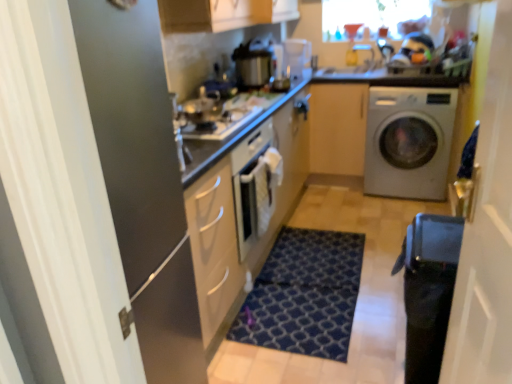
Where is `dark blue textured rug at center`? This screenshot has width=512, height=384. dark blue textured rug at center is located at coordinates (304, 294).

What do you see at coordinates (399, 76) in the screenshot?
I see `white glossy countertop at upper center` at bounding box center [399, 76].

The image size is (512, 384). Describe the element at coordinates (409, 142) in the screenshot. I see `satin silver washing machine at right` at that location.

Identify the location of metallic silver pot at center. This screenshot has height=384, width=512. (204, 108).

Can you confirm if black glossy water heater at lower right is smaller than white glossy countertop at upper center?

Indeed, black glossy water heater at lower right has a smaller size compared to white glossy countertop at upper center.

Is black glossy water heater at lower right at the left side of white glossy countertop at upper center?

Correct, you'll find black glossy water heater at lower right to the left of white glossy countertop at upper center.

Would you say black glossy water heater at lower right contains white glossy countertop at upper center?

No, white glossy countertop at upper center is not inside black glossy water heater at lower right.

In the scene shown: From a real-world perspective, which is physically above, metallic silver pot at center or dark blue textured rug at center?

metallic silver pot at center is physically above.

Who is more distant, metallic silver pot at center or dark blue textured rug at center?

metallic silver pot at center is behind.

Consider the image. From the image's perspective, is metallic silver pot at center located above dark blue textured rug at center?

Correct, metallic silver pot at center appears higher than dark blue textured rug at center in the image.

Which of these two, metallic silver pot at center or dark blue textured rug at center, is smaller?

metallic silver pot at center is smaller.

From a real-world perspective, is white plastic coffee machine at upper center above or below satin silver washing machine at right?

From a real-world perspective, white plastic coffee machine at upper center is physically above satin silver washing machine at right.

From their relative heights in the image, would you say white plastic coffee machine at upper center is taller or shorter than satin silver washing machine at right?

Considering their sizes, white plastic coffee machine at upper center has less height than satin silver washing machine at right.

Is white plastic coffee machine at upper center at the right side of satin silver washing machine at right?

No.

Does point (291, 60) appear closer or farther from the camera than point (446, 116)?

Point (291, 60) is farther from the camera than point (446, 116).

Is satin silver washing machine at right looking in the opposite direction of metallic silver pot at center?

satin silver washing machine at right is not turned away from metallic silver pot at center.

Which object is closer to the camera, satin silver washing machine at right or metallic silver pot at center?

metallic silver pot at center is more forward.

From a real-world perspective, is satin silver washing machine at right physically above metallic silver pot at center?

Actually, satin silver washing machine at right is physically below metallic silver pot at center in the real world.

Does point (302, 60) come closer to viewer compared to point (451, 279)?

No, (302, 60) is behind (451, 279).

Is white plastic coffee machine at upper center not near black glossy water heater at lower right?

Absolutely, white plastic coffee machine at upper center is distant from black glossy water heater at lower right.

Which object is positioned more to the right, white plastic coffee machine at upper center or black glossy water heater at lower right?

Positioned to the right is black glossy water heater at lower right.

Which object is further away from the camera, white plastic coffee machine at upper center or black glossy water heater at lower right?

white plastic coffee machine at upper center is further away from the camera.

From their relative heights in the image, would you say dark blue textured rug at center is taller or shorter than black glossy water heater at lower right?

In the image, dark blue textured rug at center appears to be shorter than black glossy water heater at lower right.

Where is `doormat below the black glossy water heater at lower right (from the image's perspective)`? This screenshot has width=512, height=384. doormat below the black glossy water heater at lower right (from the image's perspective) is located at coordinates (304, 294).

Considering the positions of point (308, 316) and point (408, 306), is point (308, 316) closer or farther from the camera than point (408, 306)?

Clearly, point (308, 316) is more distant from the camera than point (408, 306).

Considering the sizes of objects dark blue textured rug at center and black glossy water heater at lower right in the image provided, who is smaller, dark blue textured rug at center or black glossy water heater at lower right?

With smaller size is dark blue textured rug at center.

From their relative heights in the image, would you say satin silver washing machine at right is taller or shorter than white plastic coffee machine at upper center?

Considering their sizes, satin silver washing machine at right has more height than white plastic coffee machine at upper center.

From the image's perspective, is satin silver washing machine at right positioned above or below white plastic coffee machine at upper center?

satin silver washing machine at right is below white plastic coffee machine at upper center.

Considering the relative sizes of satin silver washing machine at right and white plastic coffee machine at upper center in the image provided, is satin silver washing machine at right wider than white plastic coffee machine at upper center?

Yes, satin silver washing machine at right is wider than white plastic coffee machine at upper center.

Is satin silver washing machine at right facing towards white plastic coffee machine at upper center?

No, satin silver washing machine at right does not turn towards white plastic coffee machine at upper center.

The height and width of the screenshot is (384, 512). In order to click on water heater below the white glossy countertop at upper center (from the image's perspective) in this screenshot , I will do `click(428, 291)`.

This screenshot has width=512, height=384. In order to click on appliance above the dark blue textured rug at center (from the image's perspective) in this screenshot , I will do `click(204, 108)`.

Looking at the image, which one is located further to satin silver washing machine at right, transparent plastic screen door at right, marked as the first screen door in a right-to-left arrangement, or metallic silver pot at center?

transparent plastic screen door at right, marked as the first screen door in a right-to-left arrangement.

Based on their spatial positions, is transparent plastic screen door at right, the 2th screen door from the left, or black glossy water heater at lower right further from metallic silver pot at center?

transparent plastic screen door at right, the 2th screen door from the left, lies further to metallic silver pot at center than the other object.

Based on the photo, when comparing their distances from satin silver gas stove at center, does white glossy countertop at upper center or matte black screen door at left, acting as the first screen door starting from the left, seem closer?

The object closer to satin silver gas stove at center is matte black screen door at left, acting as the first screen door starting from the left.

From the image, which object appears to be nearer to dark blue textured rug at center, white glossy countertop at upper center or satin silver gas stove at center?

Based on the image, satin silver gas stove at center appears to be nearer to dark blue textured rug at center.

Estimate the real-world distances between objects in this image. Which object is closer to transparent plastic screen door at right, marked as the first screen door in a right-to-left arrangement, white glossy countertop at upper center or white plastic coffee machine at upper center?

Among the two, white glossy countertop at upper center is located nearer to transparent plastic screen door at right, marked as the first screen door in a right-to-left arrangement.

Looking at the image, which one is located closer to dark blue textured rug at center, transparent plastic screen door at right, marked as the first screen door in a right-to-left arrangement, or satin silver gas stove at center?

Among the two, satin silver gas stove at center is located nearer to dark blue textured rug at center.

Looking at the image, which one is located further to white glossy countertop at upper center, satin silver gas stove at center or white plastic coffee machine at upper center?

Based on the image, satin silver gas stove at center appears to be further to white glossy countertop at upper center.

From the image, which object appears to be nearer to transparent plastic screen door at right, the 2th screen door from the left, matte wood cabinet at center or satin silver washing machine at right?

satin silver washing machine at right is closer to transparent plastic screen door at right, the 2th screen door from the left.

At what (x,y) coordinates should I click in order to perform the action: click on washing machine located between transparent plastic screen door at right, marked as the first screen door in a right-to-left arrangement, and transparent glass window screen at upper center in the depth direction. Please return your answer as a coordinate pair (x, y). This screenshot has height=384, width=512. Looking at the image, I should click on (409, 142).

Find the location of a particular element. The height and width of the screenshot is (384, 512). washing machine between black glossy water heater at lower right and transparent glass window screen at upper center from front to back is located at coordinates (409, 142).

At what (x,y) coordinates should I click in order to perform the action: click on appliance located between transparent plastic screen door at right, the 2th screen door from the left, and transparent glass window screen at upper center in the depth direction. Please return your answer as a coordinate pair (x, y). Image resolution: width=512 pixels, height=384 pixels. Looking at the image, I should click on (204, 108).

Where is `doormat between matte black screen door at left, acting as the first screen door starting from the left, and white plastic coffee machine at upper center from front to back`? The height and width of the screenshot is (384, 512). doormat between matte black screen door at left, acting as the first screen door starting from the left, and white plastic coffee machine at upper center from front to back is located at coordinates (304, 294).